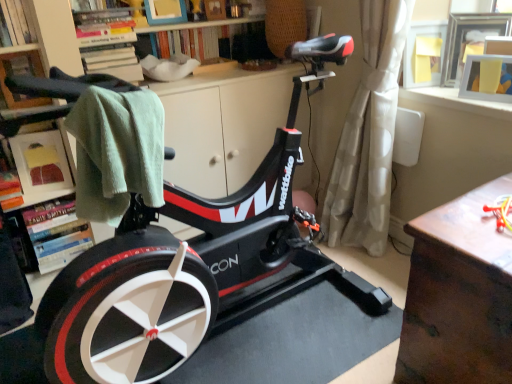
Image resolution: width=512 pixels, height=384 pixels. I want to click on empty space that is ontop of brown wooden table at right (from a real-world perspective), so click(484, 213).